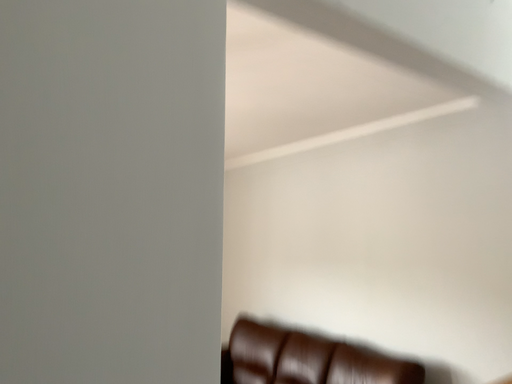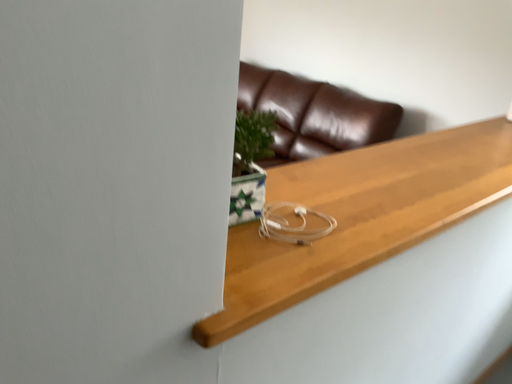
Question: Which way did the camera rotate in the video?

Choices:
 (A) rotated downward
 (B) rotated upward

Answer: (A)